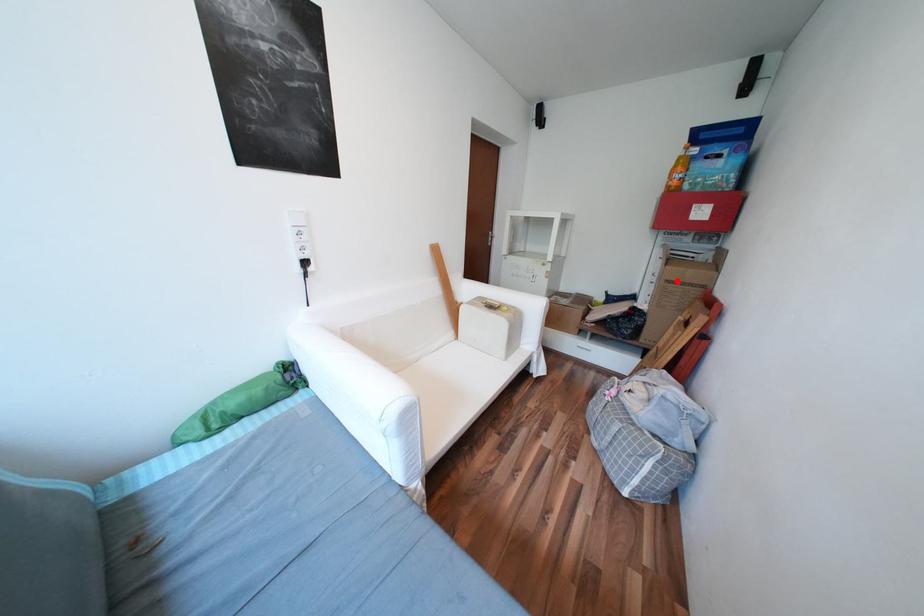
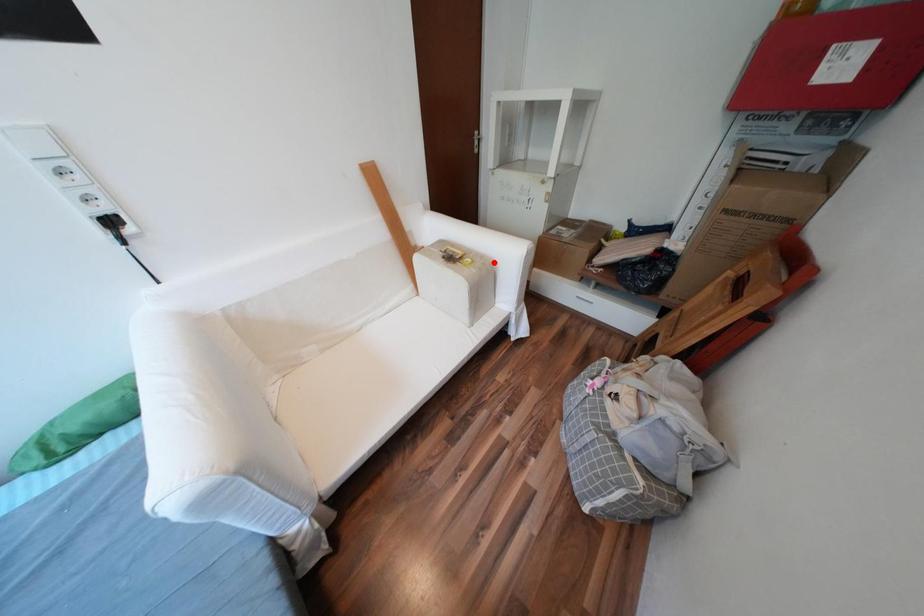
I am providing you with two images of the same scene from different viewpoints. A red point is marked on the first image and another point is marked on the second image. Do the highlighted points in image1 and image2 indicate the same real-world spot?

No